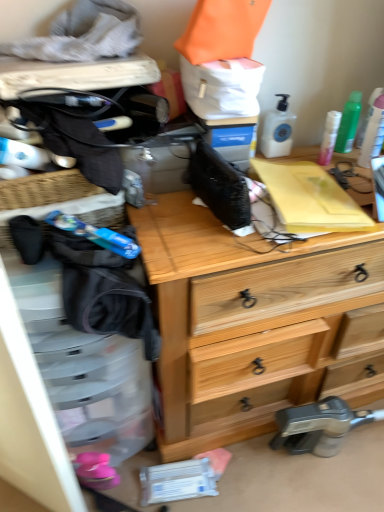
This screenshot has width=384, height=512. In order to click on vacant space to the right of white plastic pump bottle at upper right, the first toiletry from the left in this screenshot , I will do `click(310, 155)`.